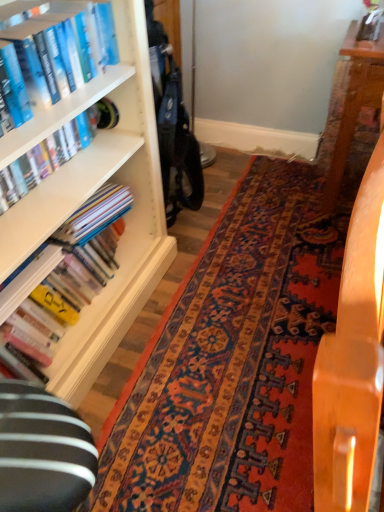
Question: Is hardcover book at left, the 2th book when ordered from top to bottom, positioned far away from carpet with intricate patterns at center?

Choices:
 (A) no
 (B) yes

Answer: (A)

Question: Is the depth of hardcover book at left, the 2th book when ordered from top to bottom, less than that of carpet with intricate patterns at center?

Choices:
 (A) yes
 (B) no

Answer: (B)

Question: From a real-world perspective, is hardcover book at left, the 2th book when ordered from top to bottom, physically below carpet with intricate patterns at center?

Choices:
 (A) no
 (B) yes

Answer: (A)

Question: Can you confirm if hardcover book at left, which is counted as the 2th book, starting from the bottom, is smaller than carpet with intricate patterns at center?

Choices:
 (A) yes
 (B) no

Answer: (A)

Question: Is carpet with intricate patterns at center at the back of hardcover book at left, which is counted as the 2th book, starting from the bottom?

Choices:
 (A) yes
 (B) no

Answer: (B)

Question: From a real-world perspective, is hardcover book at left, which is counted as the 2th book, starting from the bottom, positioned above or below hardcover books at left, which ranks as the 3th book in top-to-bottom order?

Choices:
 (A) below
 (B) above

Answer: (B)

Question: From their relative heights in the image, would you say hardcover book at left, the 2th book when ordered from top to bottom, is taller or shorter than hardcover books at left, which ranks as the 3th book in top-to-bottom order?

Choices:
 (A) tall
 (B) short

Answer: (B)

Question: Is point (4, 183) positioned closer to the camera than point (36, 300)?

Choices:
 (A) closer
 (B) farther

Answer: (A)

Question: In the image, is hardcover book at left, which is counted as the 2th book, starting from the bottom, on the left side or the right side of hardcover books at left, the first book in the bottom-to-top sequence?

Choices:
 (A) left
 (B) right

Answer: (B)

Question: Based on their sizes in the image, would you say blue hardcover book at upper left, which is the third book from bottom to top, is bigger or smaller than hardcover book at left, which is counted as the 2th book, starting from the bottom?

Choices:
 (A) big
 (B) small

Answer: (A)

Question: Do you think blue hardcover book at upper left, which is the third book from bottom to top, is within hardcover book at left, the 2th book when ordered from top to bottom, or outside of it?

Choices:
 (A) outside
 (B) inside

Answer: (A)

Question: From the image's perspective, is blue hardcover book at upper left, acting as the first book starting from the top, located above or below hardcover book at left, the 2th book when ordered from top to bottom?

Choices:
 (A) below
 (B) above

Answer: (B)

Question: From a real-world perspective, relative to hardcover book at left, which is counted as the 2th book, starting from the bottom, is blue hardcover book at upper left, which is the third book from bottom to top, vertically above or below?

Choices:
 (A) below
 (B) above

Answer: (B)

Question: Considering the positions of point (370, 202) and point (87, 8), is point (370, 202) closer or farther from the camera than point (87, 8)?

Choices:
 (A) farther
 (B) closer

Answer: (B)

Question: In the image, is wooden table at center positioned in front of or behind blue hardcover book at upper left, which is the third book from bottom to top?

Choices:
 (A) front
 (B) behind

Answer: (A)